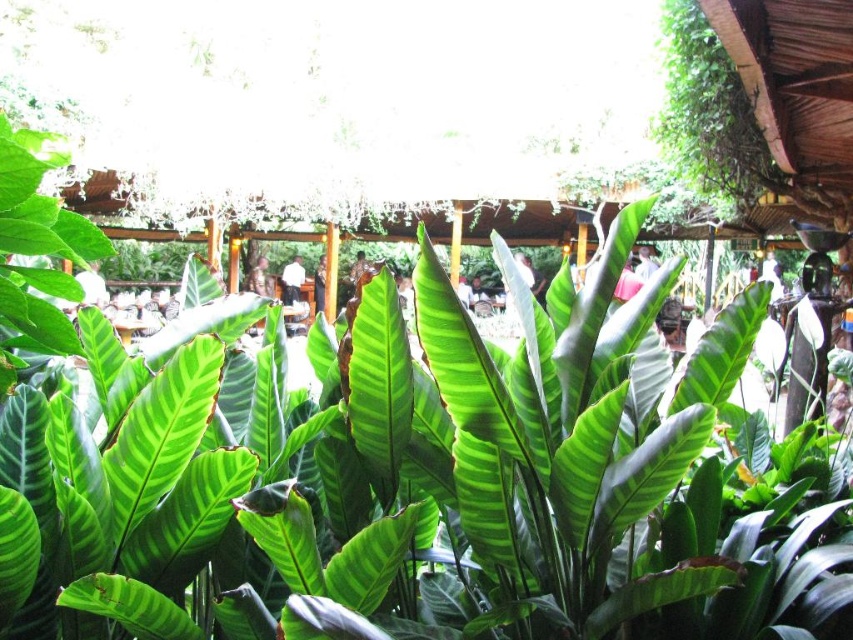
Between point (646, 260) and point (262, 276), which one is positioned in front?

Point (646, 260) is in front.

Is point (648, 248) less distant than point (254, 289)?

Yes.

Where is `white fabric shirt at upper center`? This screenshot has height=640, width=853. white fabric shirt at upper center is located at coordinates (645, 260).

Between point (293, 273) and point (322, 289), which one is positioned in front?

Point (322, 289) is in front.

Can you confirm if white shirt at center is shorter than dark brown leather jacket at center?

Yes.

Is point (302, 266) less distant than point (314, 289)?

No, it is not.

Find the location of a particular element. white shirt at center is located at coordinates (292, 280).

Does white shirt at center appear on the right side of light brown wooden chair at center?

Yes, white shirt at center is to the right of light brown wooden chair at center.

At what (x,y) coordinates should I click in order to perform the action: click on white shirt at center. Please return your answer as a coordinate pair (x, y). Looking at the image, I should click on (292, 280).